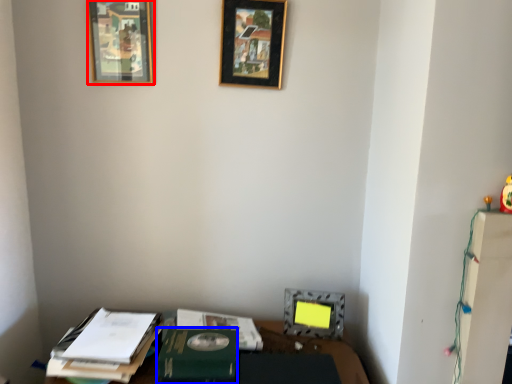
Question: Which of the following is the closest to the observer, picture frame (highlighted by a red box) or paperback book (highlighted by a blue box)?

Choices:
 (A) picture frame
 (B) paperback book

Answer: (B)